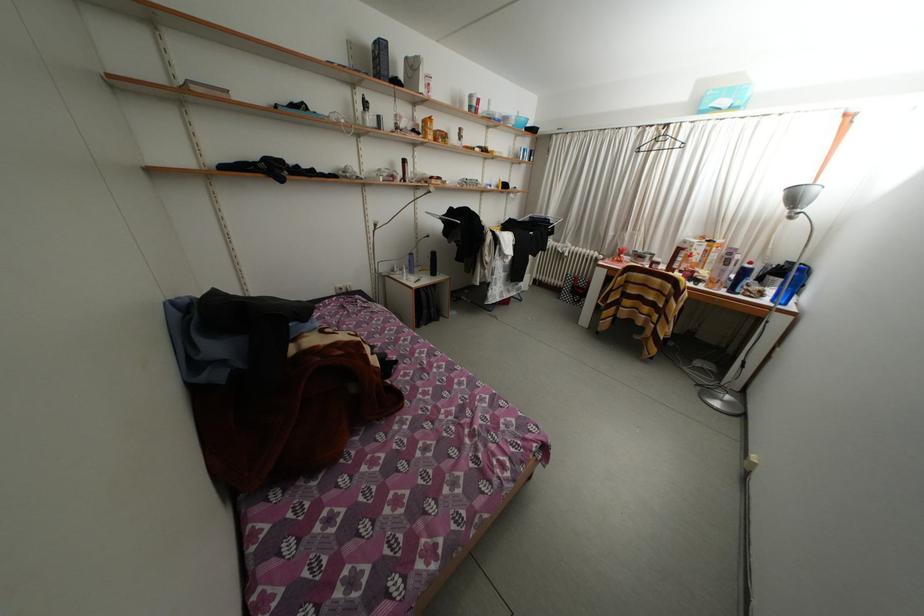
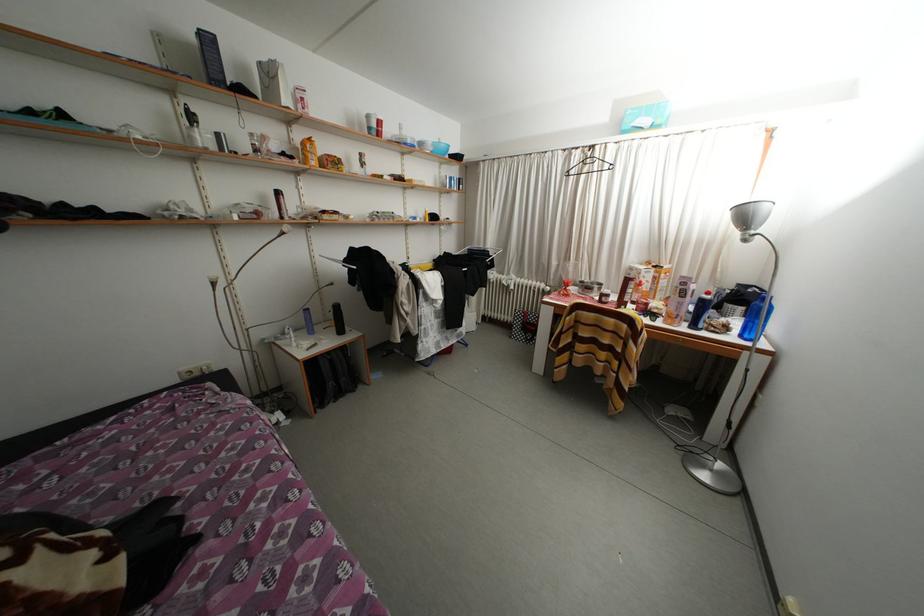
In a continuous first-person perspective shot, in which direction is the camera moving?

The cameraman walked toward right, forward.